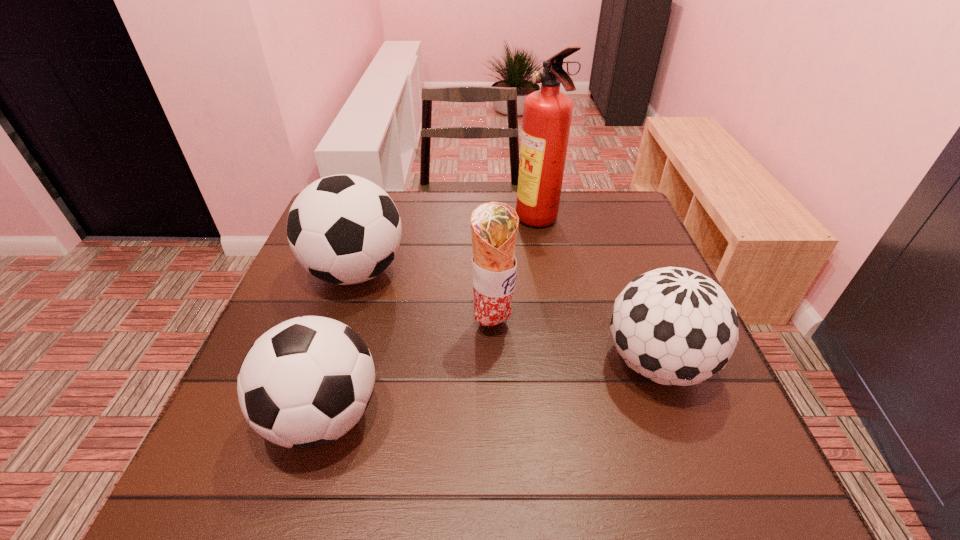
Locate an element on the screen. vacant area between the fourth nearest object and the farthest object is located at coordinates (447, 247).

Where is `vacant area that lies between the third object from right to left and the rightmost soccer ball`? This screenshot has width=960, height=540. vacant area that lies between the third object from right to left and the rightmost soccer ball is located at coordinates (574, 344).

Identify the location of free space between the fire extinguisher and the rightmost soccer ball. This screenshot has width=960, height=540. (597, 293).

Where is `free space between the rightmost soccer ball and the tallest object`? The image size is (960, 540). free space between the rightmost soccer ball and the tallest object is located at coordinates (597, 293).

Image resolution: width=960 pixels, height=540 pixels. What are the coordinates of `free point between the rightmost object and the third object from left to right` in the screenshot? It's located at (574, 344).

Identify the location of empty space that is in between the rightmost soccer ball and the third object from right to left. This screenshot has height=540, width=960. (574, 344).

Where is `free space that is in between the tallest object and the rightmost soccer ball`? The image size is (960, 540). free space that is in between the tallest object and the rightmost soccer ball is located at coordinates (597, 293).

Identify which object is the second closest to the fourth object from left to right. Please provide its 2D coordinates. Your answer should be formatted as a tuple, i.e. [(x, y)], where the tuple contains the x and y coordinates of a point satisfying the conditions above.

[(343, 229)]

Find the location of a particular element. This screenshot has height=540, width=960. object that is the nearest to the fourth nearest object is located at coordinates (494, 226).

Locate an element on the screen. This screenshot has height=540, width=960. the third closest soccer ball to the third object from left to right is located at coordinates (674, 326).